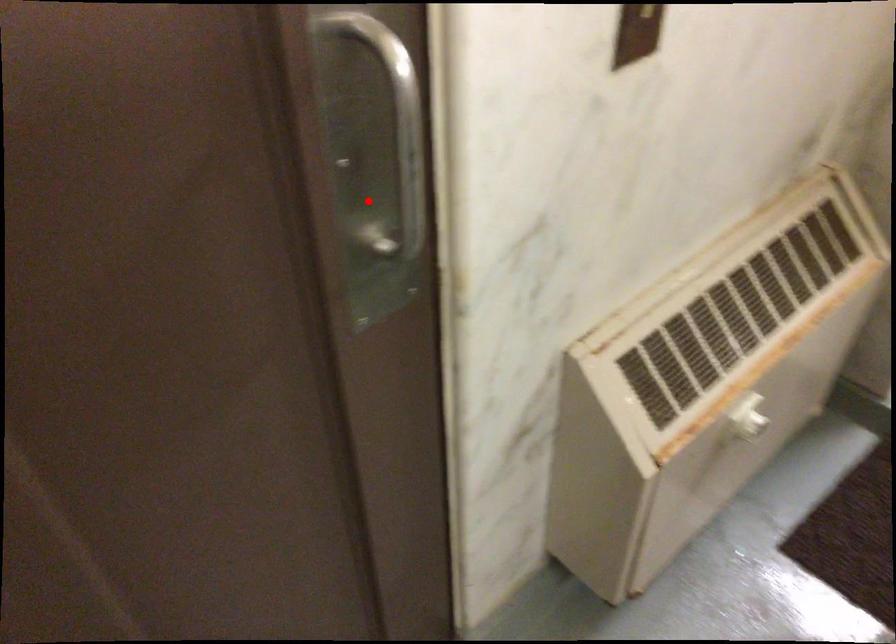
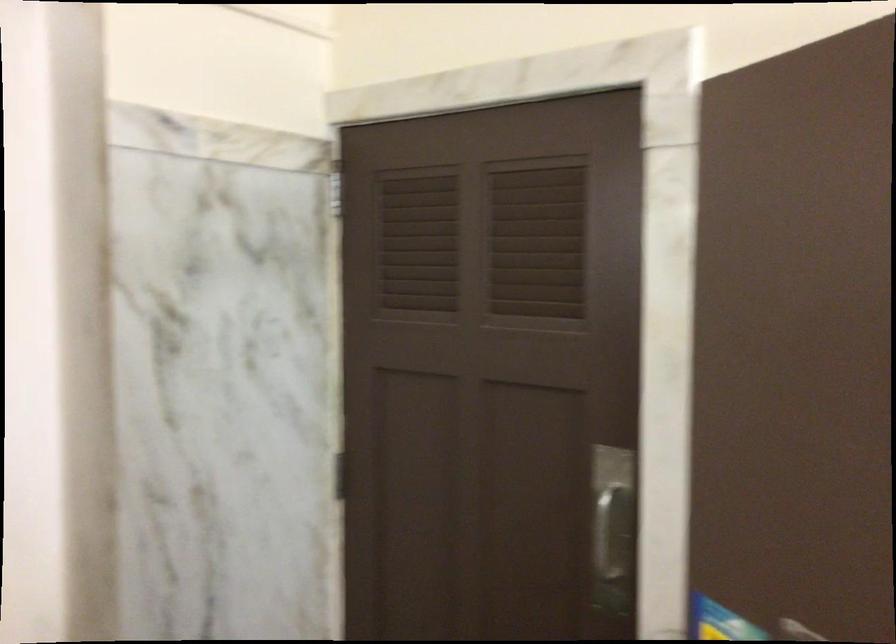
Where in the second image is the point corresponding to the highlighted location from the first image?

(612, 543)